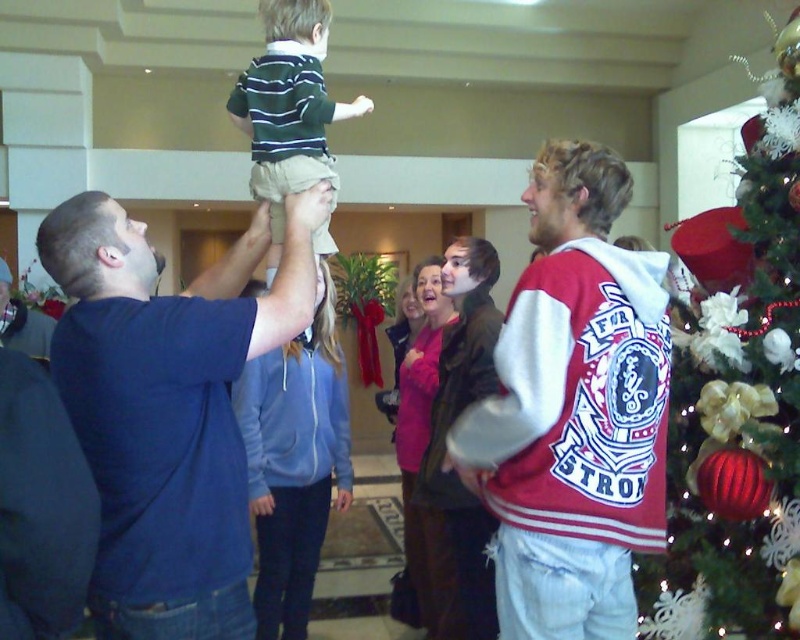
Can you confirm if shiny red ornaments at right is positioned to the right of striped knit sweater at upper center?

Yes, shiny red ornaments at right is to the right of striped knit sweater at upper center.

Does shiny red ornaments at right come in front of striped knit sweater at upper center?

That is True.

Where is `shiny red ornaments at right`? The image size is (800, 640). shiny red ornaments at right is located at coordinates (736, 394).

What are the coordinates of `shiny red ornaments at right` in the screenshot? It's located at pos(736,394).

Is dark blue t-shirt at upper left closer to the viewer compared to striped knit sweater at upper center?

That is True.

Is point (238, 536) positioned after point (320, 116)?

No, (238, 536) is closer to viewer.

Is point (80, 428) behind point (248, 77)?

No.

Find the location of a particular element. The height and width of the screenshot is (640, 800). dark blue t-shirt at upper left is located at coordinates (168, 406).

Who is higher up, maroon velvety jacket at center or striped knit sweater at upper center?

striped knit sweater at upper center is above.

Between maroon velvety jacket at center and striped knit sweater at upper center, which one has less height?

striped knit sweater at upper center

Between point (498, 586) and point (300, 20), which one is positioned in front?

Positioned in front is point (498, 586).

Locate an element on the screen. Image resolution: width=800 pixels, height=640 pixels. maroon velvety jacket at center is located at coordinates (574, 412).